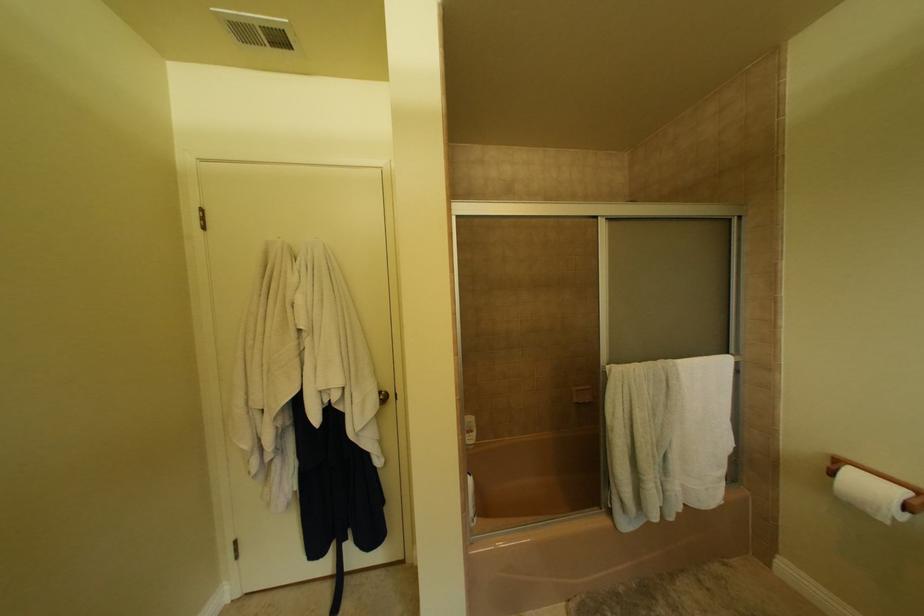
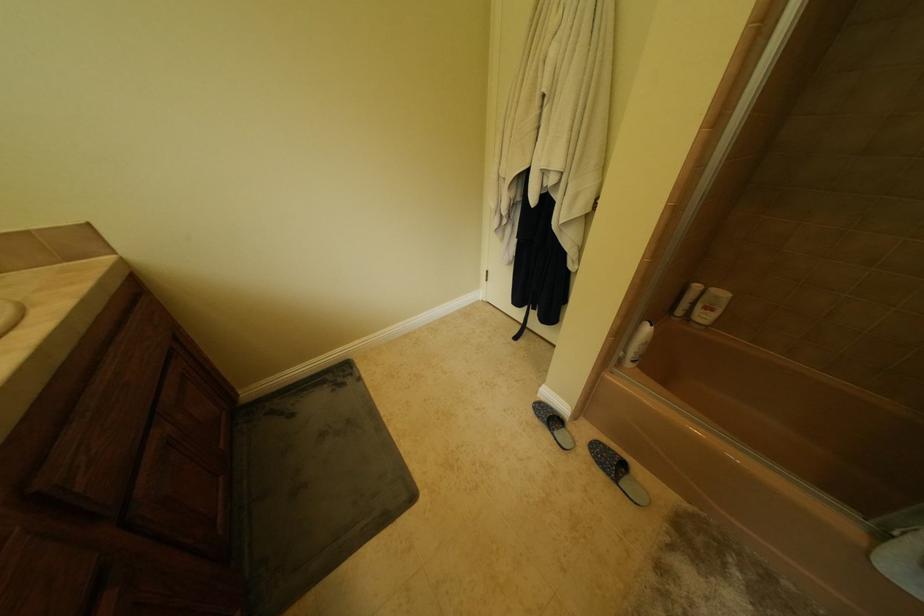
Based on the continuous images, in which direction is the camera rotating?

The rotation direction of the camera is left-down.